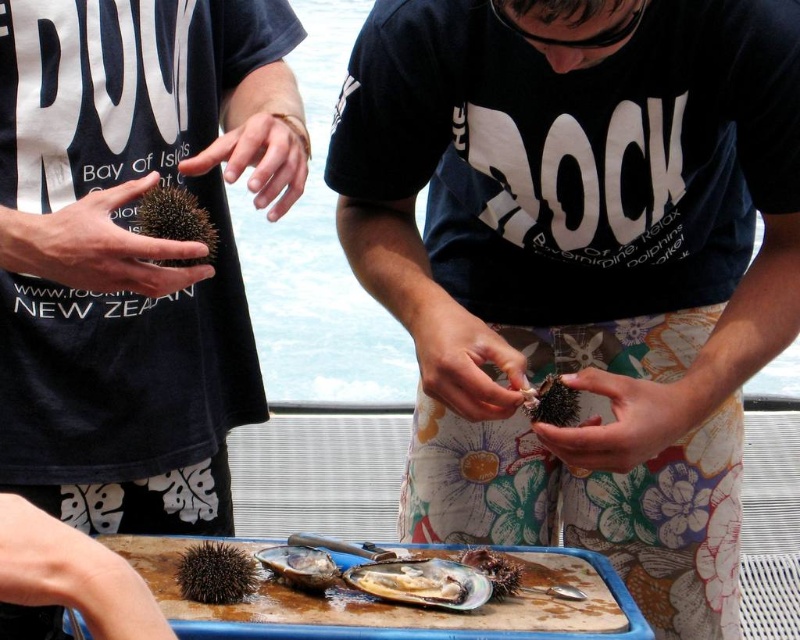
user is a photographer who wants to capture the shiny silver oyster at center in focus without blurring the background. The photographer is currently standing 1.5 meters away from the oyster. What should they do to ensure the oyster is in focus?

The shiny silver oyster at center is 1.42 meters away from the camera. The photographer is standing 1.5 meters away, so they should move 0.08 meters closer to the oyster to align with the camera distance for focus. Alternatively, adjust the camera settings to focus precisely at 1.42 meters.

Based on the photo, what is the spatial relationship between the shiny silver oyster at center and the spiky brown sea urchin at center?

The shiny silver oyster at center is in front of the spiky brown sea urchin at center.